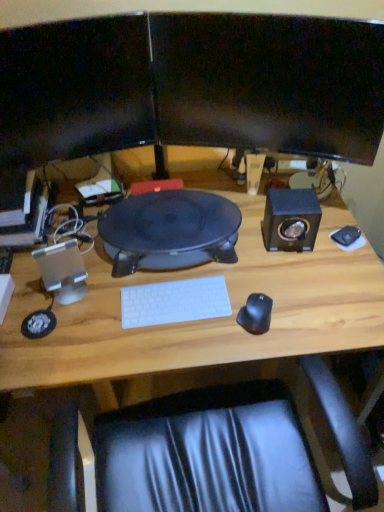
Identify the location of vacant area that lies between white plastic keyboard at center and black matte mouse at right, acting as the second mouse starting from the front. (266, 269).